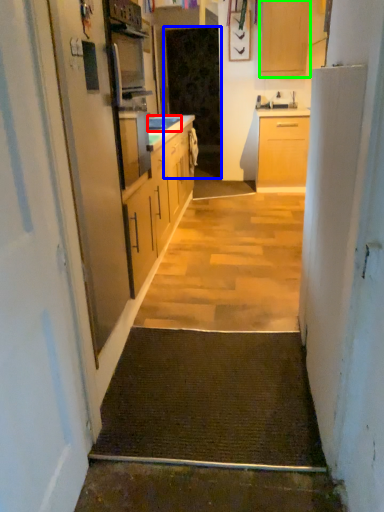
Question: Considering the real-world distances, which object is closest to sink (highlighted by a red box)? screen door (highlighted by a blue box) or cabinetry (highlighted by a green box).

Choices:
 (A) screen door
 (B) cabinetry

Answer: (A)